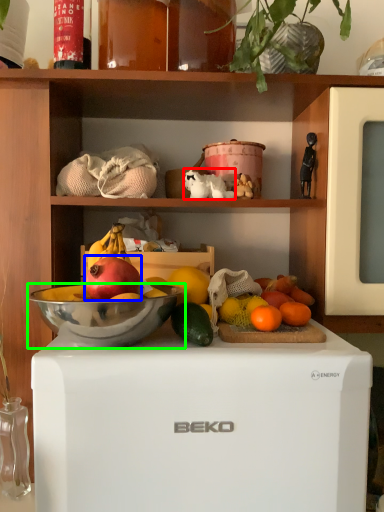
Question: Based on their relative distances, which object is nearer to animal (highlighted by a red box)? Choose from grapefruit (highlighted by a blue box) and bowl (highlighted by a green box).

Choices:
 (A) grapefruit
 (B) bowl

Answer: (A)